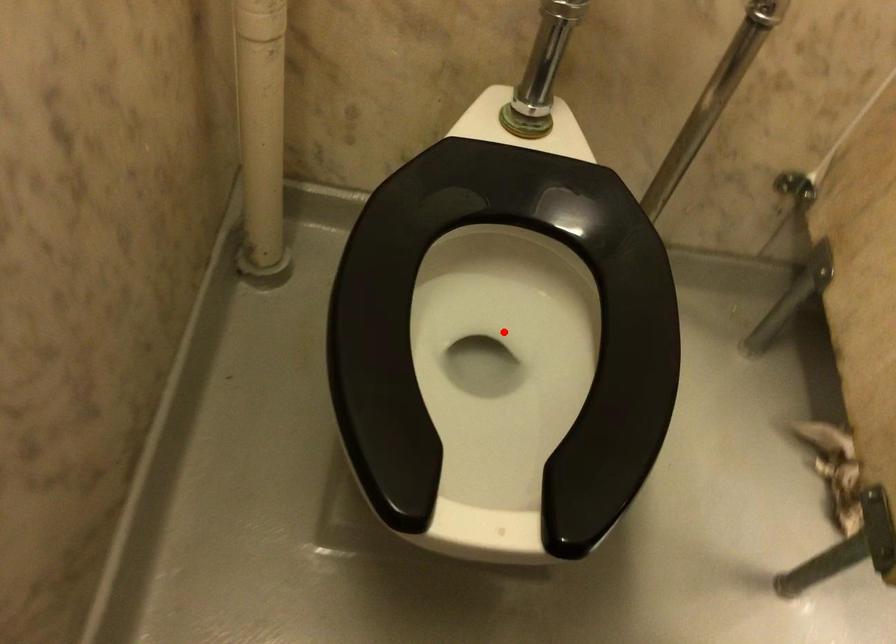
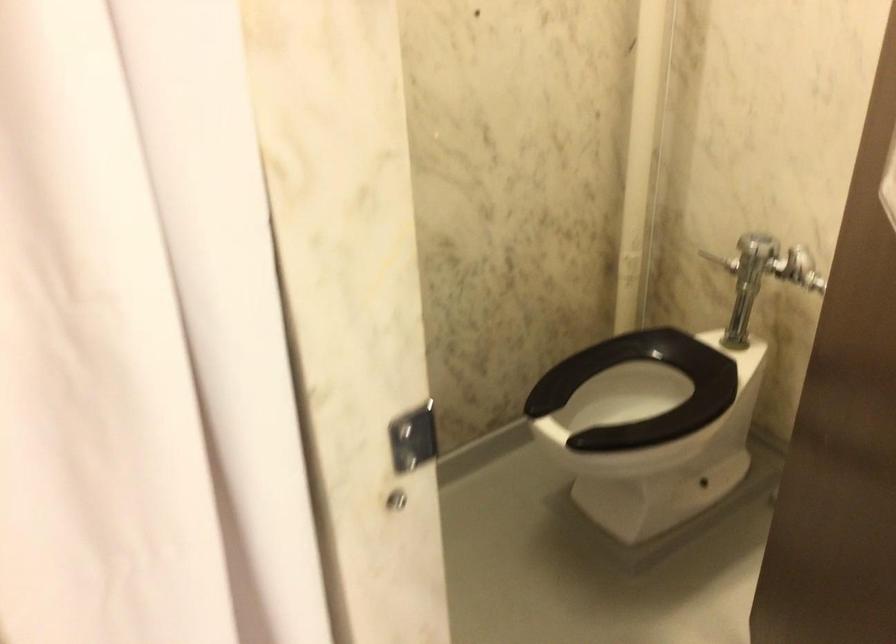
Question: I am providing you with two images of the same scene from different viewpoints. A red point is marked on the first image. At the location where the point appears in image 1, is it still visible in image 2?

Choices:
 (A) Yes
 (B) No

Answer: (B)